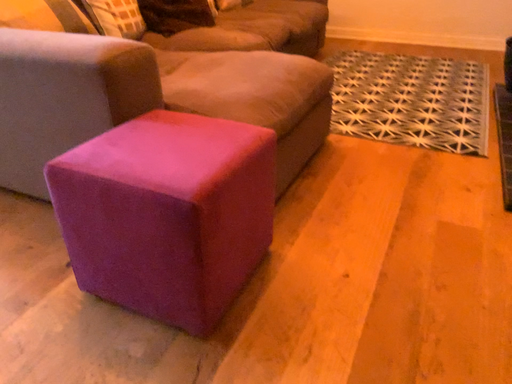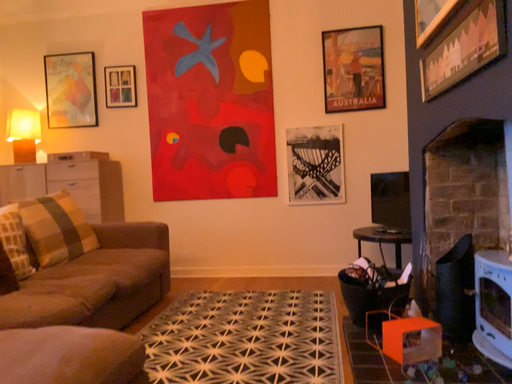
Question: How did the camera likely rotate when shooting the video?

Choices:
 (A) rotated downward
 (B) rotated upward

Answer: (B)